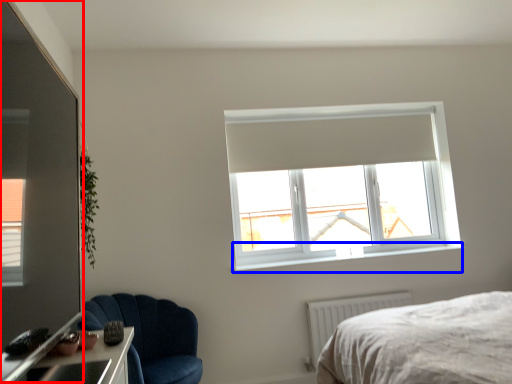
Question: Which object appears closest to the camera in this image, glass door (highlighted by a red box) or window sill (highlighted by a blue box)?

Choices:
 (A) glass door
 (B) window sill

Answer: (A)